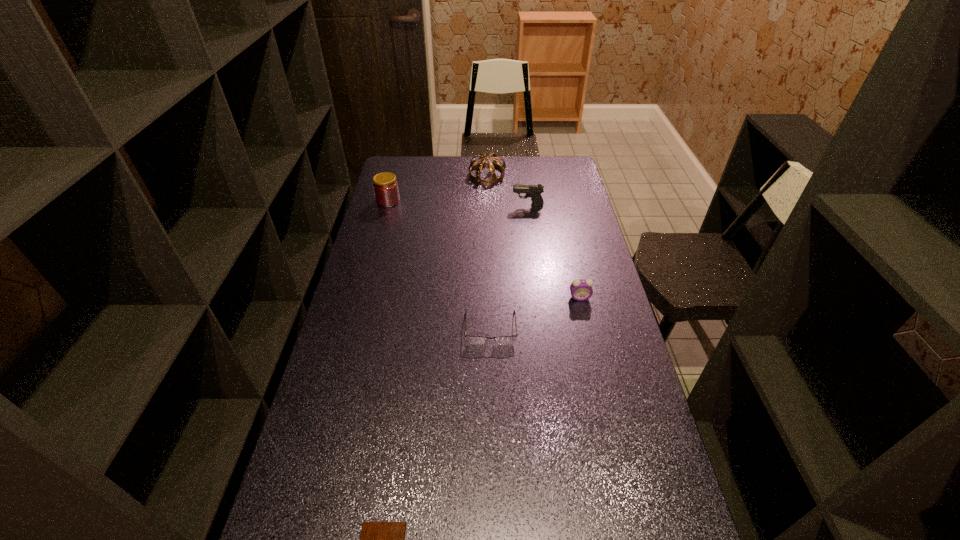
Find the location of `the farthest object`. the farthest object is located at coordinates (492, 178).

Where is `the leftmost object`? The image size is (960, 540). the leftmost object is located at coordinates (385, 186).

This screenshot has height=540, width=960. I want to click on pistol, so click(x=534, y=191).

Locate an element on the screen. This screenshot has width=960, height=540. the fifth object from left to right is located at coordinates (534, 191).

Where is `the third nearest object`? the third nearest object is located at coordinates (581, 289).

Image resolution: width=960 pixels, height=540 pixels. What are the coordinates of `the right alarm clock` in the screenshot? It's located at (581, 289).

The image size is (960, 540). What are the coordinates of `spectacles` in the screenshot? It's located at (478, 340).

Find the location of a particular element. Image resolution: width=960 pixels, height=540 pixels. the fifth tallest object is located at coordinates (478, 340).

The image size is (960, 540). What are the coordinates of `free point located 0.050m on the back of the tiara` in the screenshot? It's located at (487, 160).

The height and width of the screenshot is (540, 960). I want to click on vacant space located on the back of the leftmost object, so click(399, 159).